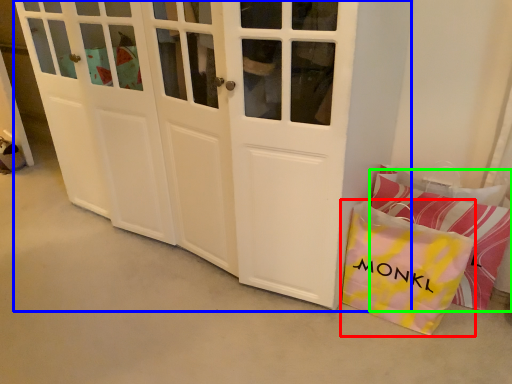
Question: Estimate the real-world distances between objects in this image. Which object is farther from gift bag (highlighted by a red box), door (highlighted by a blue box) or pillow (highlighted by a green box)?

Choices:
 (A) door
 (B) pillow

Answer: (A)